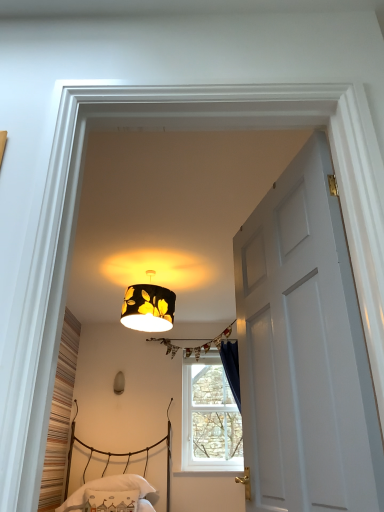
Question: Is white plastic window at center directly adjacent to white fabric pillow at lower center?

Choices:
 (A) yes
 (B) no

Answer: (B)

Question: Is white fabric pillow at lower center completely or partially inside white plastic window at center?

Choices:
 (A) no
 (B) yes

Answer: (A)

Question: Considering the relative sizes of white plastic window at center and white fabric pillow at lower center in the image provided, is white plastic window at center wider than white fabric pillow at lower center?

Choices:
 (A) yes
 (B) no

Answer: (B)

Question: Is white plastic window at center positioned with its back to white fabric pillow at lower center?

Choices:
 (A) no
 (B) yes

Answer: (A)

Question: Does white plastic window at center appear on the left side of white fabric pillow at lower center?

Choices:
 (A) yes
 (B) no

Answer: (B)

Question: Considering their positions, is white cotton pillow at lower center located in front of or behind matte yellow fabric lampshade at upper center, which ranks as the second lamp in top-to-bottom order?

Choices:
 (A) behind
 (B) front

Answer: (B)

Question: Considering the positions of point (107, 492) and point (115, 376), is point (107, 492) closer or farther from the camera than point (115, 376)?

Choices:
 (A) farther
 (B) closer

Answer: (B)

Question: Is white cotton pillow at lower center spatially inside matte yellow fabric lampshade at upper center, which is the second lamp in front-to-back order, or outside of it?

Choices:
 (A) outside
 (B) inside

Answer: (A)

Question: In terms of size, does white cotton pillow at lower center appear bigger or smaller than matte yellow fabric lampshade at upper center, which ranks as the second lamp in top-to-bottom order?

Choices:
 (A) small
 (B) big

Answer: (B)

Question: From the image's perspective, relative to white cotton pillow at lower center, is white glossy door at center above or below?

Choices:
 (A) below
 (B) above

Answer: (B)

Question: Would you say white glossy door at center is inside or outside white cotton pillow at lower center?

Choices:
 (A) outside
 (B) inside

Answer: (A)

Question: In terms of size, does white glossy door at center appear bigger or smaller than white cotton pillow at lower center?

Choices:
 (A) small
 (B) big

Answer: (A)

Question: Relative to white cotton pillow at lower center, is white glossy door at center in front or behind?

Choices:
 (A) front
 (B) behind

Answer: (A)

Question: From the image's perspective, is white plastic window at center above or below matte yellow fabric lampshade at upper center, which is the first lamp from back to front?

Choices:
 (A) below
 (B) above

Answer: (A)

Question: Considering the positions of white plastic window at center and matte yellow fabric lampshade at upper center, which is counted as the 2th lamp, starting from the right, in the image, is white plastic window at center taller or shorter than matte yellow fabric lampshade at upper center, which is counted as the 2th lamp, starting from the right,?

Choices:
 (A) tall
 (B) short

Answer: (A)